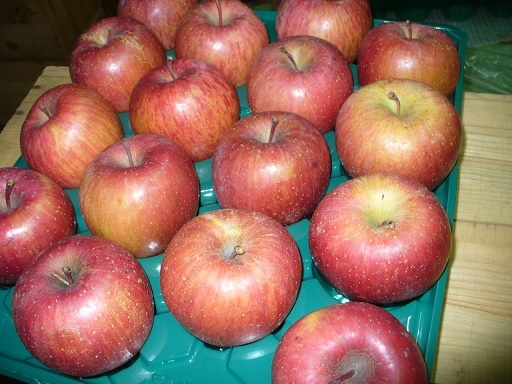
Find the location of `table`. table is located at coordinates (484, 266), (6, 144).